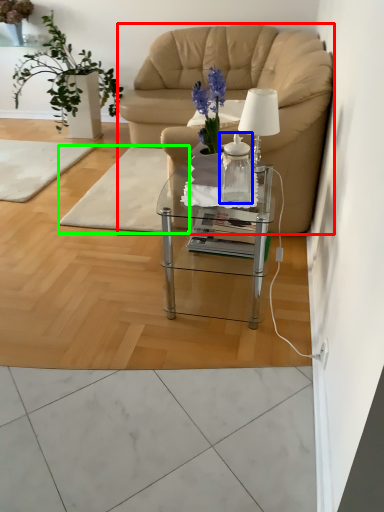
Question: Which is farther away from chair (highlighted by a red box)? vase (highlighted by a blue box) or mat (highlighted by a green box)?

Choices:
 (A) vase
 (B) mat

Answer: (A)